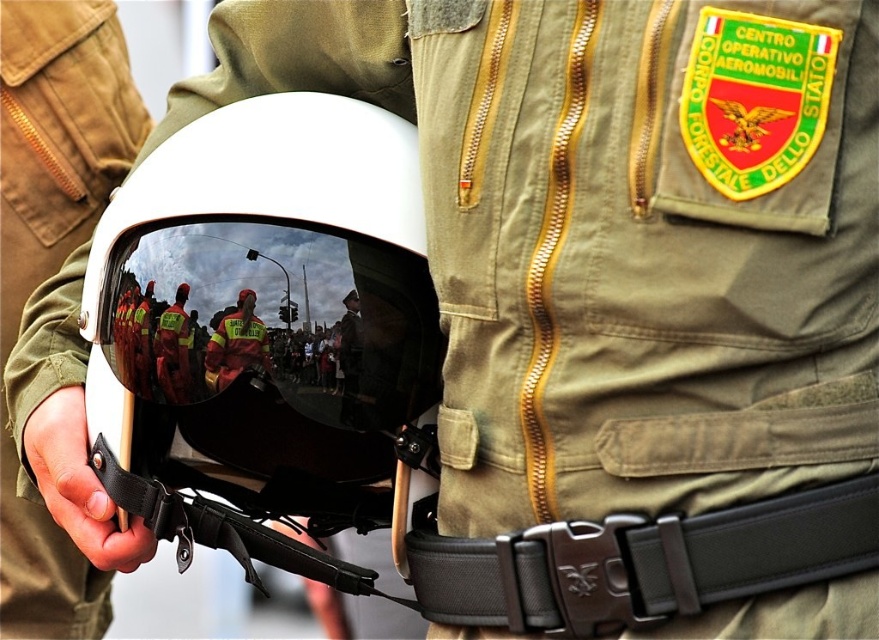
Is point (238, 339) less distant than point (184, 355)?

Yes, it is in front of point (184, 355).

Can you confirm if reflective plastic helmet at center is positioned to the right of reflective yellow vest at center?

Correct, you'll find reflective plastic helmet at center to the right of reflective yellow vest at center.

What do you see at coordinates (236, 344) in the screenshot? I see `reflective plastic helmet at center` at bounding box center [236, 344].

Identify the location of reflective plastic helmet at center. (236, 344).

Does point (185, 440) come in front of point (173, 333)?

No, it is not.

Is point (304, 397) farther from camera compared to point (183, 301)?

Yes, point (304, 397) is farther from viewer.

Find the location of a particular element. The width and height of the screenshot is (879, 640). shiny reflective goggles at center is located at coordinates (271, 288).

Consider the image. Is shiny reflective goggles at center in front of reflective plastic helmet at center?

Yes, shiny reflective goggles at center is in front of reflective plastic helmet at center.

Between shiny reflective goggles at center and reflective plastic helmet at center, which one has more height?

Standing taller between the two is shiny reflective goggles at center.

The width and height of the screenshot is (879, 640). Describe the element at coordinates (271, 288) in the screenshot. I see `shiny reflective goggles at center` at that location.

Identify the location of shiny reflective goggles at center. Image resolution: width=879 pixels, height=640 pixels. (271, 288).